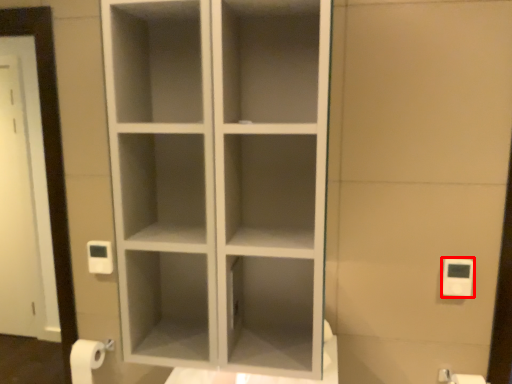
Question: Observing the image, what is the correct spatial positioning of light switch (annotated by the red box) in reference to toilet paper?

Choices:
 (A) left
 (B) right

Answer: (A)